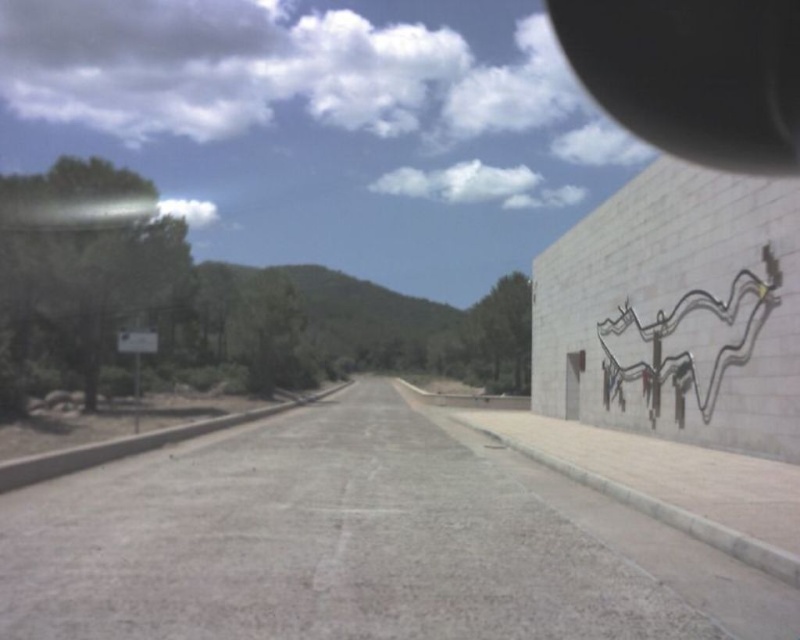
Question: Can you confirm if black rubber view mirror at upper right is positioned to the left of metallic silver octopus at right?

Choices:
 (A) yes
 (B) no

Answer: (B)

Question: Which of the following is the farthest from the observer?

Choices:
 (A) metallic silver octopus at right
 (B) black rubber view mirror at upper right

Answer: (B)

Question: Is black rubber view mirror at upper right further to camera compared to metallic silver octopus at right?

Choices:
 (A) no
 (B) yes

Answer: (B)

Question: Is black rubber view mirror at upper right positioned in front of metallic silver octopus at right?

Choices:
 (A) yes
 (B) no

Answer: (B)